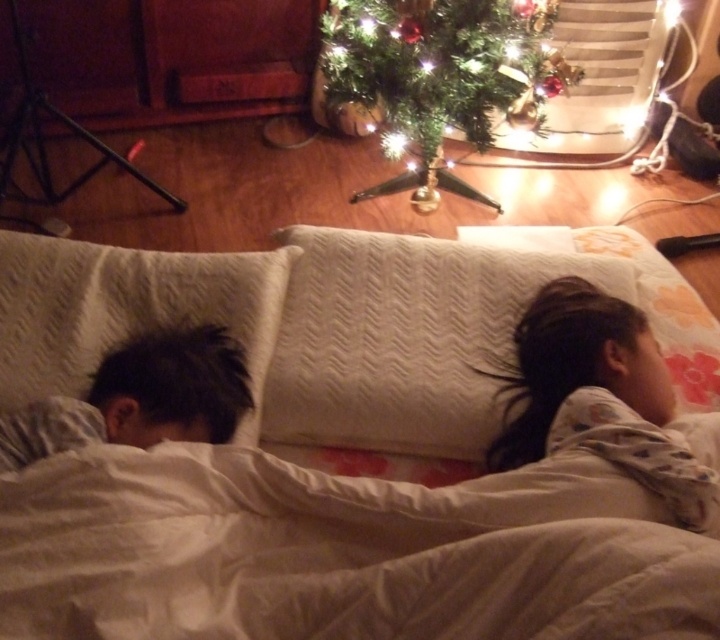
You are a photographer trying to capture a closeup of the green textured christmas tree at upper center without including the white textured pillow at left in the frame. Based on their thickness, is this possible?

The white textured pillow at left is thinner than the green textured christmas tree at upper center, so it is possible to capture a closeup of the green textured christmas tree at upper center without including the white textured pillow at left in the frame because the pillow takes up less space in the image.

You are a parent standing in the room and want to check on the children sleeping on the bed. The green textured christmas tree at upper center is in your way. Can you walk around it to reach the bed?

The green textured christmas tree at upper center is 1.59 meters away from you. Since it is placed on the wooden floor and not blocking the entire path, you can walk around it to reach the bed.